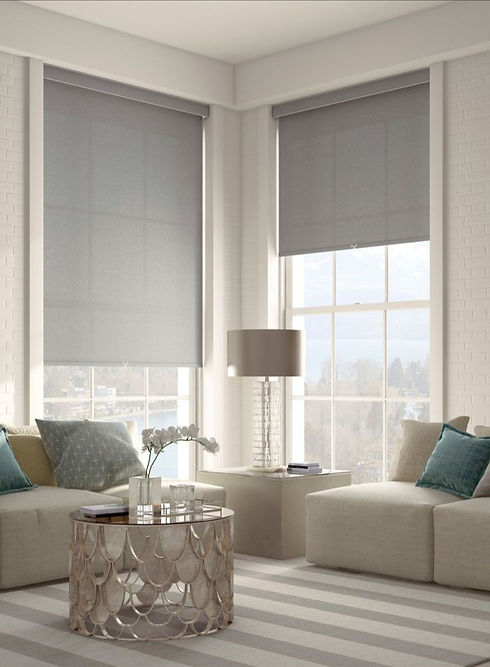
Locate an element on the screen. This screenshot has width=490, height=667. rug is located at coordinates (324, 635).